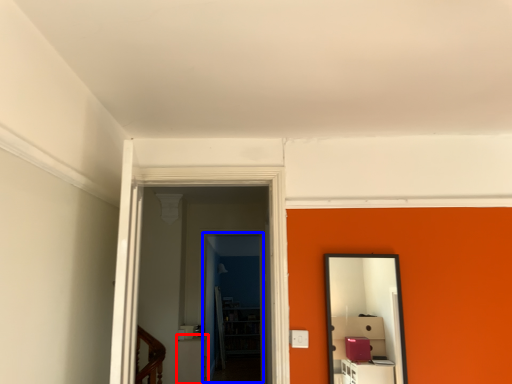
Question: Which point is further to the camera, furniture (highlighted by a red box) or glass door (highlighted by a blue box)?

Choices:
 (A) furniture
 (B) glass door

Answer: (B)